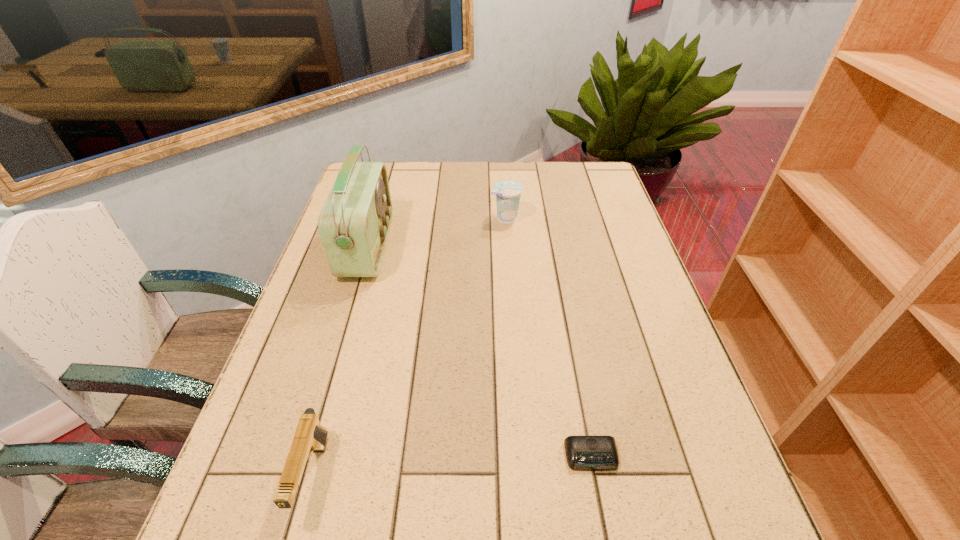
At what (x,y) coordinates should I click in order to perform the action: click on radio receiver. Please return your answer as a coordinate pair (x, y). This screenshot has width=960, height=540. Looking at the image, I should click on (354, 223).

Locate an element on the screen. Image resolution: width=960 pixels, height=540 pixels. the second object from right to left is located at coordinates (507, 192).

The width and height of the screenshot is (960, 540). I want to click on pistol, so click(309, 436).

At what (x,y) coordinates should I click in order to perform the action: click on the rightmost object. Please return your answer as a coordinate pair (x, y). This screenshot has height=540, width=960. Looking at the image, I should click on (587, 453).

At what (x,y) coordinates should I click in order to perform the action: click on alarm clock. Please return your answer as a coordinate pair (x, y). Looking at the image, I should click on (587, 453).

In order to click on vacant space located 0.130m on the front panel of the tallest object in this screenshot , I will do click(433, 247).

Find the location of a particular element. This screenshot has width=960, height=540. vacant space located 0.400m on the front of the yogurt is located at coordinates (514, 326).

I want to click on blank area located on the display of the shortest object, so coord(606,532).

The height and width of the screenshot is (540, 960). I want to click on object present at the near edge, so click(309, 436).

Image resolution: width=960 pixels, height=540 pixels. I want to click on radio receiver that is at the left edge, so click(x=354, y=223).